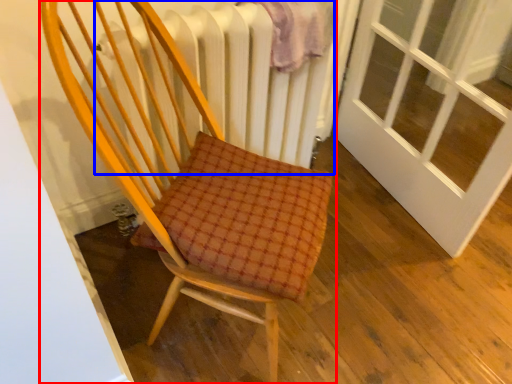
Question: Which object appears closest to the camera in this image, chair (highlighted by a red box) or radiator (highlighted by a blue box)?

Choices:
 (A) chair
 (B) radiator

Answer: (A)